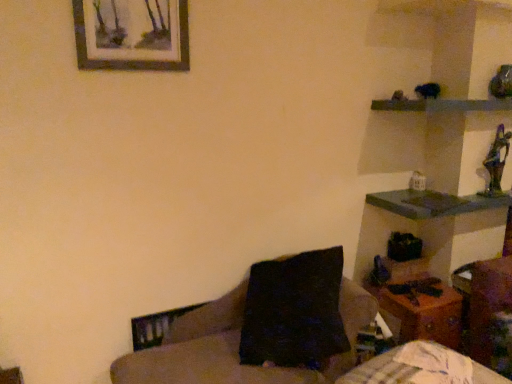
Identify the location of wooden shelf at upper right. This screenshot has width=512, height=384. (442, 105).

You are a GUI agent. You are given a task and a screenshot of the screen. Output one action in this format:
    pyautogui.click(x=<x>, y=<y>)
    Task: Click on the wooden picture frame at upper left
    This screenshot has width=512, height=384.
    Given the screenshot: What is the action you would take?
    pyautogui.click(x=132, y=34)

The height and width of the screenshot is (384, 512). Identify the location of dark brown fabric couch at center. (233, 346).

From the image's perspective, is wooden table at lower right above wooden shelf at upper right?

Actually, wooden table at lower right appears below wooden shelf at upper right in the image.

Can we say wooden table at lower right lies outside wooden shelf at upper right?

Yes, wooden table at lower right is not within wooden shelf at upper right.

Does wooden table at lower right have a larger size compared to wooden shelf at upper right?

Yes, wooden table at lower right is bigger than wooden shelf at upper right.

Is wooden table at lower right thinner than wooden shelf at upper right?

Correct, the width of wooden table at lower right is less than that of wooden shelf at upper right.

Which is behind, point (392, 326) or point (100, 64)?

The point (392, 326) is more distant.

Consider the image. Is wooden picture frame at upper left inside wooden table at lower right?

No.

Could you tell me if wooden table at lower right is facing wooden picture frame at upper left?

No, wooden table at lower right does not turn towards wooden picture frame at upper left.

Is wooden table at lower right shorter than wooden picture frame at upper left?

No.

Does wooden picture frame at upper left have a smaller size compared to wooden table at lower right?

Yes.

Choose the correct answer: Is wooden picture frame at upper left inside wooden table at lower right or outside it?

wooden picture frame at upper left is spatially situated outside wooden table at lower right.

From the image's perspective, is wooden picture frame at upper left under wooden table at lower right?

No.

Between point (154, 56) and point (448, 291), which one is positioned behind?

The point (448, 291) is more distant.

From the image's perspective, would you say dark brown fabric couch at center is shown under wooden table at lower right?

Correct, dark brown fabric couch at center appears lower than wooden table at lower right in the image.

Which object is thinner, dark brown fabric couch at center or wooden table at lower right?

Thinner between the two is wooden table at lower right.

Is dark brown fabric couch at center at the right side of wooden table at lower right?

No, dark brown fabric couch at center is not to the right of wooden table at lower right.

Is wooden shelf at upper right behind wooden picture frame at upper left?

Yes.

Is wooden shelf at upper right situated inside wooden picture frame at upper left or outside?

wooden shelf at upper right is located beyond the bounds of wooden picture frame at upper left.

Can you confirm if wooden shelf at upper right is wider than wooden picture frame at upper left?

Yes.

Would you consider wooden shelf at upper right to be distant from wooden picture frame at upper left?

Yes.

Considering the relative positions of dark brown fabric couch at center and wooden picture frame at upper left in the image provided, is dark brown fabric couch at center behind wooden picture frame at upper left?

No, dark brown fabric couch at center is closer to the camera.

Can you confirm if dark brown fabric couch at center is wider than wooden picture frame at upper left?

Yes, dark brown fabric couch at center is wider than wooden picture frame at upper left.

In the scene shown: Is the surface of dark brown fabric couch at center in direct contact with wooden picture frame at upper left?

They are not placed beside each other.

Do you think dark brown fabric couch at center is within wooden picture frame at upper left, or outside of it?

The correct answer is: outside.

From a real-world perspective, is wooden picture frame at upper left below wooden shelf at upper right?

No, from a real-world perspective, wooden picture frame at upper left is not under wooden shelf at upper right.

Is wooden picture frame at upper left looking in the opposite direction of wooden shelf at upper right?

wooden picture frame at upper left does not have its back to wooden shelf at upper right.

Would you say wooden picture frame at upper left is outside wooden shelf at upper right?

Absolutely, wooden picture frame at upper left is external to wooden shelf at upper right.

Based on the photo, considering their positions, is wooden picture frame at upper left located in front of or behind wooden shelf at upper right?

Clearly, wooden picture frame at upper left is in front of wooden shelf at upper right.

Locate an element on the screen. table below the wooden shelf at upper right (from the image's perspective) is located at coordinates click(x=422, y=315).

This screenshot has width=512, height=384. In order to click on table below the wooden picture frame at upper left (from a real-world perspective) in this screenshot , I will do [422, 315].

When comparing their distances from wooden table at lower right, does dark brown fabric couch at center or wooden shelf at upper right seem closer?

dark brown fabric couch at center lies closer to wooden table at lower right than the other object.

Looking at the image, which one is located closer to wooden table at lower right, dark brown fabric couch at center or wooden picture frame at upper left?

dark brown fabric couch at center is positioned closer to the anchor wooden table at lower right.

Estimate the real-world distances between objects in this image. Which object is closer to wooden picture frame at upper left, wooden shelf at upper right or dark brown fabric couch at center?

dark brown fabric couch at center is positioned closer to the anchor wooden picture frame at upper left.

When comparing their distances from wooden picture frame at upper left, does wooden table at lower right or wooden shelf at upper right seem closer?

wooden shelf at upper right is closer to wooden picture frame at upper left.

Which object lies further to the anchor point wooden table at lower right, wooden shelf at upper right or wooden picture frame at upper left?

wooden picture frame at upper left is further to wooden table at lower right.

When comparing their distances from dark brown fabric couch at center, does wooden shelf at upper right or wooden table at lower right seem closer?

wooden table at lower right is positioned closer to the anchor dark brown fabric couch at center.

When comparing their distances from wooden table at lower right, does wooden picture frame at upper left or dark brown fabric couch at center seem further?

wooden picture frame at upper left is further to wooden table at lower right.

From the image, which object appears to be farther from wooden shelf at upper right, wooden table at lower right or wooden picture frame at upper left?

Among the two, wooden picture frame at upper left is located further to wooden shelf at upper right.

This screenshot has height=384, width=512. What are the coordinates of `table that lies between wooden shelf at upper right and dark brown fabric couch at center from top to bottom` in the screenshot? It's located at (422, 315).

This screenshot has width=512, height=384. Find the location of `furniture between wooden picture frame at upper left and wooden shelf at upper right in the horizontal direction`. furniture between wooden picture frame at upper left and wooden shelf at upper right in the horizontal direction is located at coordinates (233, 346).

Where is `table between wooden picture frame at upper left and wooden shelf at upper right from left to right`? This screenshot has height=384, width=512. table between wooden picture frame at upper left and wooden shelf at upper right from left to right is located at coordinates (422, 315).

Locate an element on the screen. table between wooden picture frame at upper left and dark brown fabric couch at center vertically is located at coordinates (422, 315).